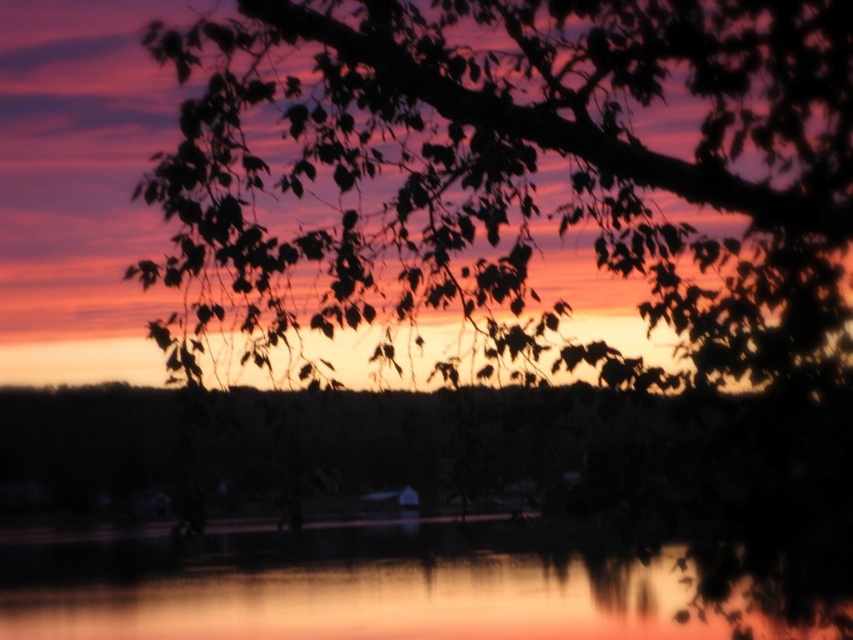
Question: Does silhouette leaves at upper center have a larger size compared to smooth water at center?

Choices:
 (A) yes
 (B) no

Answer: (A)

Question: Which object is closer to the camera taking this photo?

Choices:
 (A) silhouette leaves at upper center
 (B) smooth water at center

Answer: (A)

Question: Which object is closer to the camera taking this photo?

Choices:
 (A) silhouette leaves at upper center
 (B) smooth water at center

Answer: (A)

Question: Does silhouette leaves at upper center come behind smooth water at center?

Choices:
 (A) no
 (B) yes

Answer: (A)

Question: Is silhouette leaves at upper center wider than smooth water at center?

Choices:
 (A) yes
 (B) no

Answer: (B)

Question: Among these points, which one is nearest to the camera?

Choices:
 (A) tap(543, 634)
 (B) tap(711, 84)

Answer: (B)